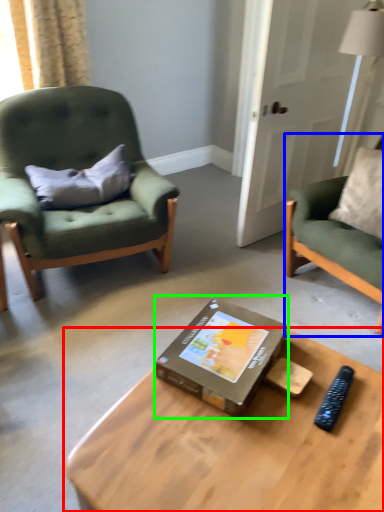
Question: Estimate the real-world distances between objects in this image. Which object is farther from coffee table (highlighted by a red box), chair (highlighted by a blue box) or box (highlighted by a green box)?

Choices:
 (A) chair
 (B) box

Answer: (A)